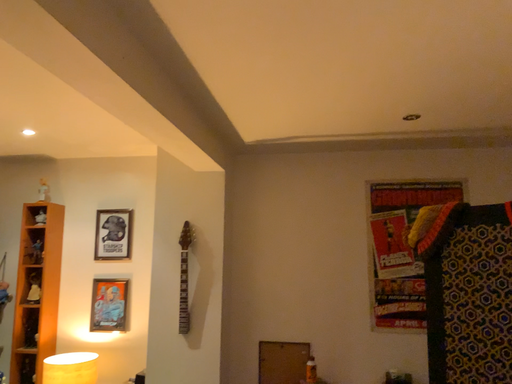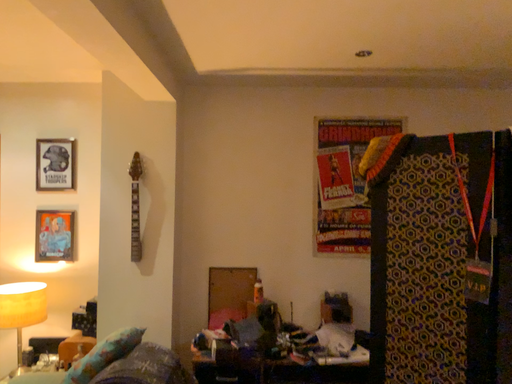
Question: How did the camera likely rotate when shooting the video?

Choices:
 (A) rotated right
 (B) rotated left

Answer: (A)